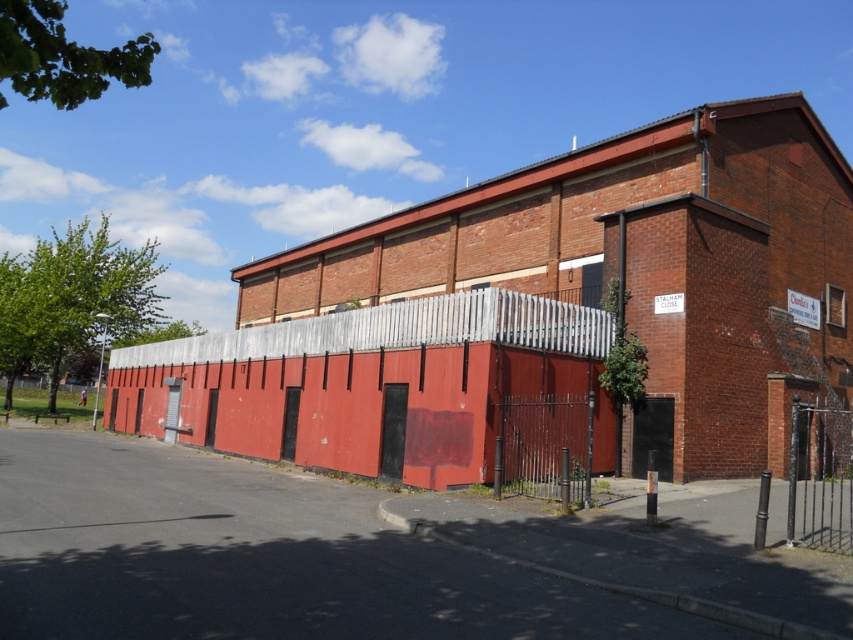
Question: Does brick building at center appear on the right side of smooth red fence at center?

Choices:
 (A) no
 (B) yes

Answer: (B)

Question: Estimate the real-world distances between objects in this image. Which object is closer to the black wrought iron gate at center?

Choices:
 (A) black wrought iron fence at right
 (B) brick building at center
 (C) smooth red fence at center

Answer: (A)

Question: Does smooth red fence at center have a larger size compared to black wrought iron fence at right?

Choices:
 (A) no
 (B) yes

Answer: (B)

Question: Based on their relative distances, which object is nearer to the smooth red fence at center?

Choices:
 (A) brick building at center
 (B) black wrought iron fence at right
 (C) black wrought iron gate at center

Answer: (A)

Question: Does smooth red fence at center have a lesser width compared to black wrought iron gate at center?

Choices:
 (A) yes
 (B) no

Answer: (B)

Question: Which object is positioned farthest from the black wrought iron gate at center?

Choices:
 (A) brick building at center
 (B) smooth red fence at center
 (C) black wrought iron fence at right

Answer: (B)